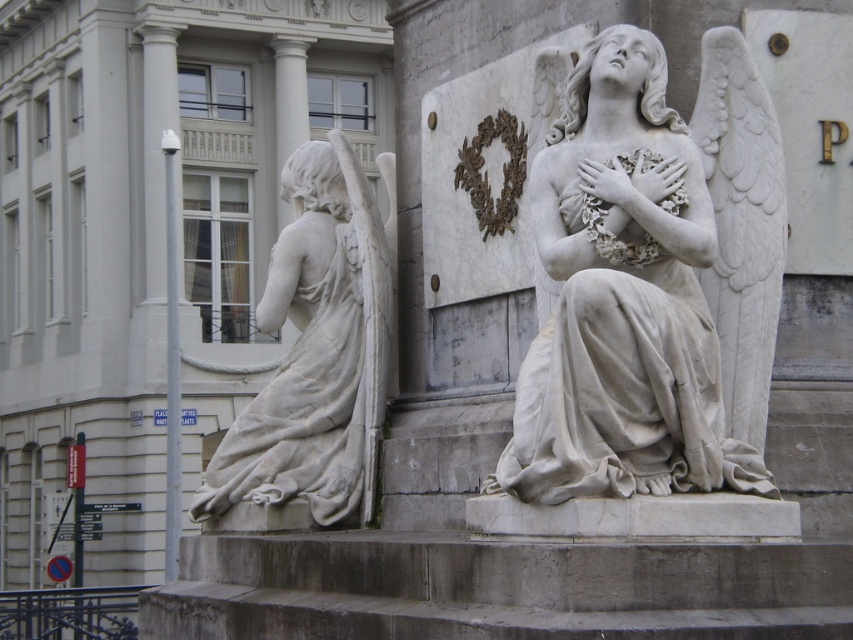
Question: From the image, what is the correct spatial relationship of white marble statue at center in relation to white marble statue at left?

Choices:
 (A) right
 (B) left

Answer: (A)

Question: Does gray concrete stairs at center lie in front of white marble statue at left?

Choices:
 (A) yes
 (B) no

Answer: (A)

Question: Which object appears closest to the camera in this image?

Choices:
 (A) gray concrete stairs at center
 (B) white marble statue at center
 (C) white marble statue at left

Answer: (A)

Question: Can you confirm if white marble statue at center is positioned to the left of gray concrete stairs at center?

Choices:
 (A) no
 (B) yes

Answer: (A)

Question: Which point appears farthest from the camera in this image?

Choices:
 (A) (766, 273)
 (B) (378, 312)

Answer: (B)

Question: Estimate the real-world distances between objects in this image. Which object is farther from the gray concrete stairs at center?

Choices:
 (A) white marble statue at left
 (B) white marble statue at center

Answer: (A)